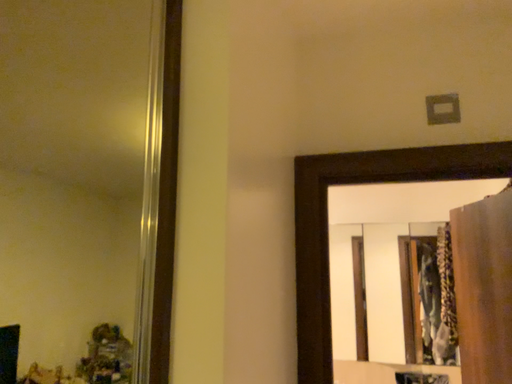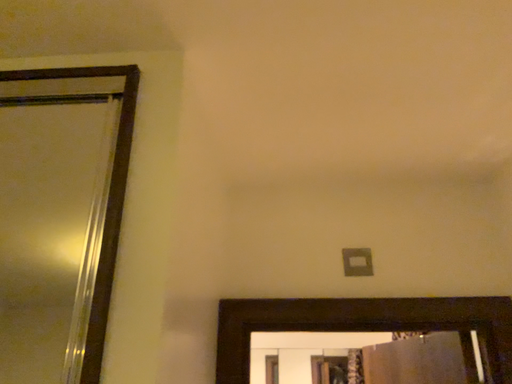
Question: Which way did the camera rotate in the video?

Choices:
 (A) rotated left
 (B) rotated right

Answer: (B)